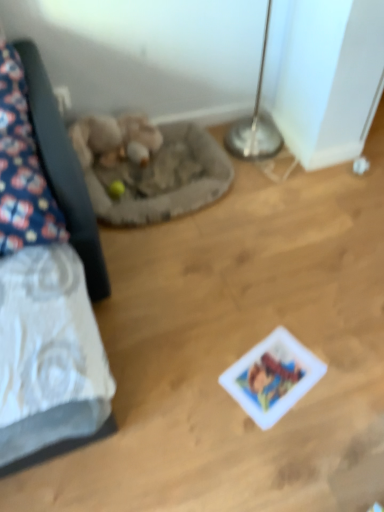
The width and height of the screenshot is (384, 512). I want to click on unoccupied space behind white glossy card at center, so click(268, 315).